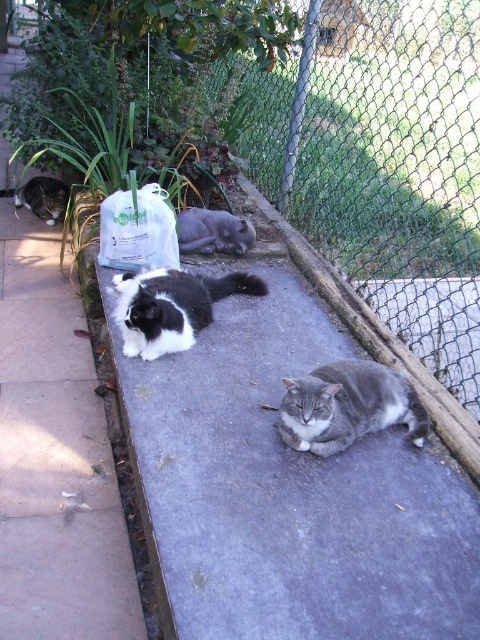
You are standing at the entrance of the pathway and want to approach the gray fluffy cat at center. Based on its position, which direction should you move to reach it?

The gray fluffy cat at center is located at point 0.636 on the x and 0.725 on the y axis. Since you are at the entrance, you should move forward towards the center of the pathway to reach it.

You are a cat owner who wants to know which of your two cats is taller. You have a black and white fur cat at center and a black and white fur cat at left in the image. Which one is taller?

The black and white fur cat at center is much taller than the black and white fur cat at left according to the description.